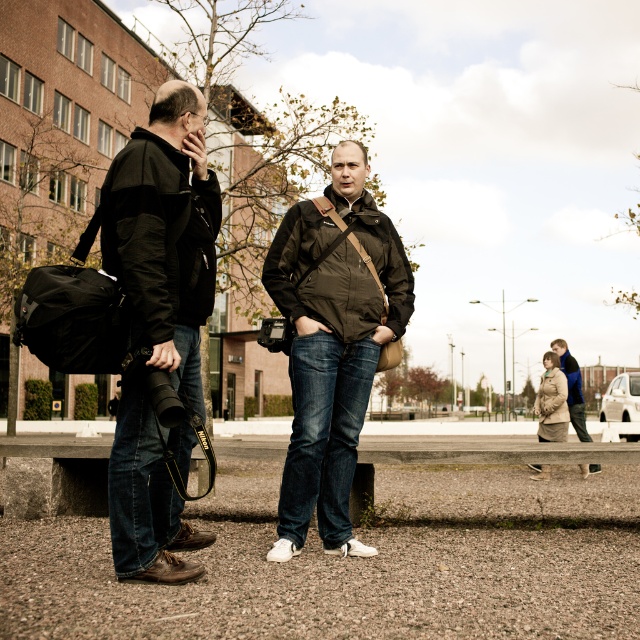
You are a delivery person needing to place a package between the beige wool coat at lower right and the brown textured jacket at lower right. Can you fit the package in the space between them?

The distance between the beige wool coat at lower right and the brown textured jacket at lower right is 11.76 feet, so yes, the package can be placed between them as there is sufficient space.

You are a photographer trying to capture the scene with your camera. You want to ensure that the point at coordinates (157, 323) is clearly visible in your shot. Which object from the scene should you focus on to include this point?

The point at coordinates (157, 323) is located on the matte black jacket at left, so you should focus on the matte black jacket at left to ensure it is visible in your shot.